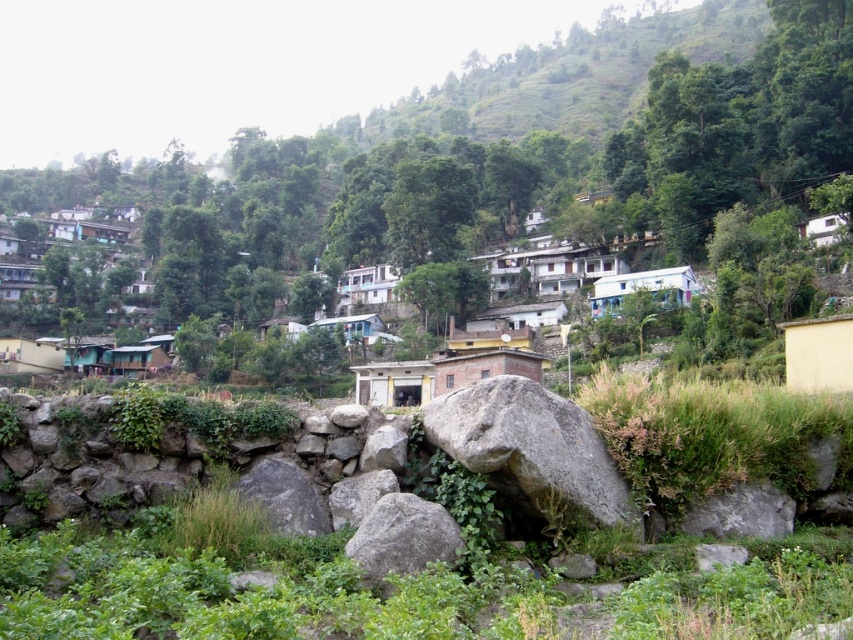
Question: Is gray rough rock at center positioned behind white matte house at upper right?

Choices:
 (A) no
 (B) yes

Answer: (A)

Question: Among these objects, which one is farthest from the camera?

Choices:
 (A) yellow matte wall at right
 (B) green matte hut at center

Answer: (B)

Question: Based on their relative distances, which object is nearer to the gray rough rock at center?

Choices:
 (A) gray rough boulder at center
 (B) white painted wood hut at center

Answer: (A)

Question: Does gray rough rock at center have a larger size compared to teal painted wood hut at center?

Choices:
 (A) yes
 (B) no

Answer: (B)

Question: Is yellow matte wall at right to the left of white matte house at upper right from the viewer's perspective?

Choices:
 (A) no
 (B) yes

Answer: (B)

Question: Which object is closer to the camera taking this photo?

Choices:
 (A) gray rough rock at center
 (B) white painted wood hut at center

Answer: (A)